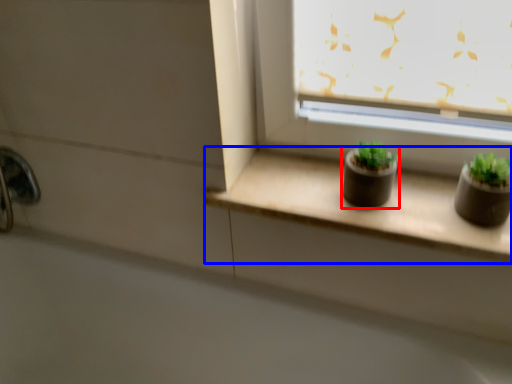
Question: Among these objects, which one is farthest to the camera, flowerpot (highlighted by a red box) or window sill (highlighted by a blue box)?

Choices:
 (A) flowerpot
 (B) window sill

Answer: (A)